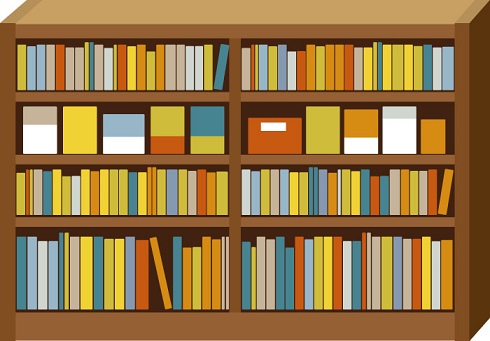
This screenshot has width=490, height=341. Find the location of `boxes`. boxes is located at coordinates (432, 141), (402, 132), (367, 137), (322, 131), (284, 140), (203, 131), (165, 131), (126, 139), (80, 136), (37, 127).